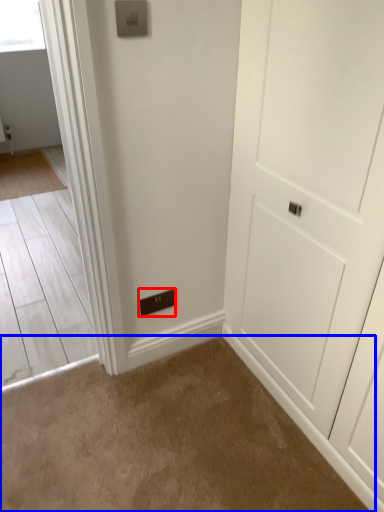
Question: Which object appears closest to the camera in this image, light switch (highlighted by a red box) or plain (highlighted by a blue box)?

Choices:
 (A) light switch
 (B) plain

Answer: (B)